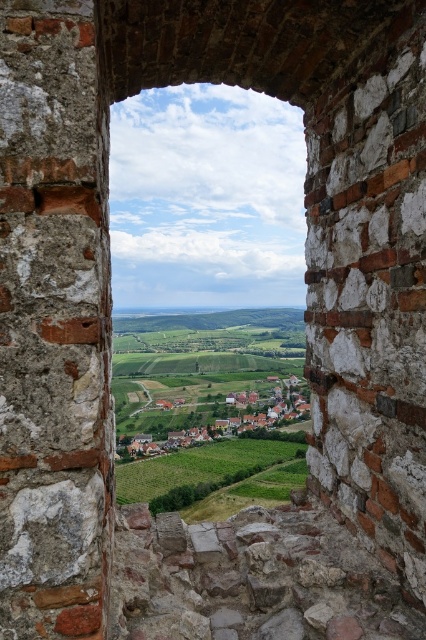
Question: Which object is farther from the camera taking this photo?

Choices:
 (A) green grassy field at center
 (B) green grassy village at center

Answer: (B)

Question: Is transparent glass window at center bigger than green grassy field at center?

Choices:
 (A) yes
 (B) no

Answer: (A)

Question: Can you confirm if transparent glass window at center is smaller than green grassy village at center?

Choices:
 (A) yes
 (B) no

Answer: (B)

Question: Which point is farther to the camera?

Choices:
 (A) (135, 280)
 (B) (245, 417)

Answer: (A)

Question: Is transparent glass window at center to the left of green grassy village at center from the viewer's perspective?

Choices:
 (A) yes
 (B) no

Answer: (B)

Question: Which object is the closest to the green grassy field at center?

Choices:
 (A) green grassy village at center
 (B) transparent glass window at center

Answer: (A)